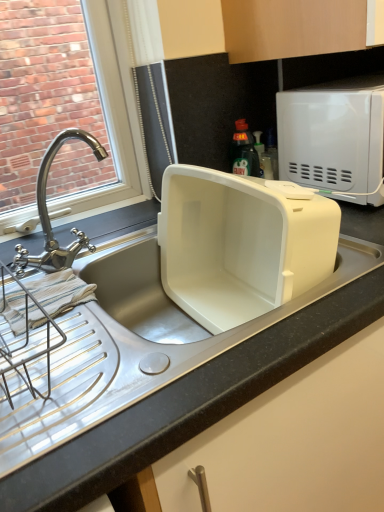
The width and height of the screenshot is (384, 512). Describe the element at coordinates (333, 134) in the screenshot. I see `white matte microwave at upper right` at that location.

Where is `white matte microwave at upper right`? This screenshot has height=512, width=384. white matte microwave at upper right is located at coordinates (333, 134).

What do you see at coordinates (50, 216) in the screenshot? I see `polished chrome faucet at left` at bounding box center [50, 216].

Find the location of a particular element. The height and width of the screenshot is (512, 384). polished chrome faucet at left is located at coordinates (x=50, y=216).

You are a GUI agent. You are given a task and a screenshot of the screen. Output one action in this format:
    pyautogui.click(x=<x>, y=<y>)
    Task: Click on the white matte microwave at upper right
    
    Given the screenshot: What is the action you would take?
    pyautogui.click(x=333, y=134)

Which is more to the left, white matte microwave at upper right or polished chrome faucet at left?

Positioned to the left is polished chrome faucet at left.

Does white matte microwave at upper right lie in front of polished chrome faucet at left?

No, white matte microwave at upper right is further to the viewer.

Is point (305, 184) farther from viewer compared to point (81, 233)?

That is True.

From the image's perspective, which one is positioned higher, white matte microwave at upper right or polished chrome faucet at left?

white matte microwave at upper right appears higher in the image.

In the scene shown: From a real-world perspective, is white matte microwave at upper right positioned above or below polished chrome faucet at left?

Clearly, from a real-world perspective, white matte microwave at upper right is below polished chrome faucet at left.

Considering the sizes of objects white matte microwave at upper right and polished chrome faucet at left in the image provided, who is wider, white matte microwave at upper right or polished chrome faucet at left?

white matte microwave at upper right is wider.

In terms of height, does white matte microwave at upper right look taller or shorter compared to polished chrome faucet at left?

In the image, white matte microwave at upper right appears to be shorter than polished chrome faucet at left.

Which of these two, white matte microwave at upper right or polished chrome faucet at left, is smaller?

polished chrome faucet at left is smaller.

Is white matte microwave at upper right not inside polished chrome faucet at left?

That's correct, white matte microwave at upper right is outside of polished chrome faucet at left.

Is white matte microwave at upper right beside polished chrome faucet at left?

white matte microwave at upper right is not next to polished chrome faucet at left, and they're not touching.

Could you tell me if white matte microwave at upper right is turned towards polished chrome faucet at left?

No, white matte microwave at upper right does not turn towards polished chrome faucet at left.

How distant is white matte microwave at upper right from polished chrome faucet at left?

white matte microwave at upper right is 20.93 inches away from polished chrome faucet at left.

There is a white matte microwave at upper right. Where is `tap above it (from a real-world perspective)`? The image size is (384, 512). tap above it (from a real-world perspective) is located at coordinates (50, 216).

Considering the relative positions of polished chrome faucet at left and white matte microwave at upper right in the image provided, is polished chrome faucet at left to the left or to the right of white matte microwave at upper right?

Based on their positions, polished chrome faucet at left is located to the left of white matte microwave at upper right.

Which object is closer to the camera taking this photo, polished chrome faucet at left or white matte microwave at upper right?

Positioned in front is polished chrome faucet at left.

Does point (88, 245) appear closer or farther from the camera than point (340, 175)?

Point (88, 245) is positioned closer to the camera compared to point (340, 175).

From the image's perspective, is polished chrome faucet at left located above or below white matte microwave at upper right?

polished chrome faucet at left is below white matte microwave at upper right.

From a real-world perspective, is polished chrome faucet at left on white matte microwave at upper right?

Yes, from a real-world perspective, polished chrome faucet at left is above white matte microwave at upper right.

Does polished chrome faucet at left have a lesser width compared to white matte microwave at upper right?

Indeed, polished chrome faucet at left has a lesser width compared to white matte microwave at upper right.

Considering the sizes of polished chrome faucet at left and white matte microwave at upper right in the image, is polished chrome faucet at left taller or shorter than white matte microwave at upper right?

Clearly, polished chrome faucet at left is taller compared to white matte microwave at upper right.

Between polished chrome faucet at left and white matte microwave at upper right, which one has smaller size?

Smaller between the two is polished chrome faucet at left.

Is polished chrome faucet at left completely or partially outside of white matte microwave at upper right?

That's correct, polished chrome faucet at left is outside of white matte microwave at upper right.

Is polished chrome faucet at left beside white matte microwave at upper right?

There is a gap between polished chrome faucet at left and white matte microwave at upper right.

Is polished chrome faucet at left looking in the opposite direction of white matte microwave at upper right?

No, polished chrome faucet at left's orientation is not away from white matte microwave at upper right.

Can you tell me how much polished chrome faucet at left and white matte microwave at upper right differ in facing direction?

There is a 0.000852-degree angle between the facing directions of polished chrome faucet at left and white matte microwave at upper right.

Identify the location of microwave oven above the polished chrome faucet at left (from the image's perspective). The height and width of the screenshot is (512, 384). (333, 134).

The width and height of the screenshot is (384, 512). In order to click on tap on the left of white matte microwave at upper right in this screenshot , I will do `click(50, 216)`.

Where is `tap that is above the white matte microwave at upper right (from a real-world perspective)`? The width and height of the screenshot is (384, 512). tap that is above the white matte microwave at upper right (from a real-world perspective) is located at coordinates (50, 216).